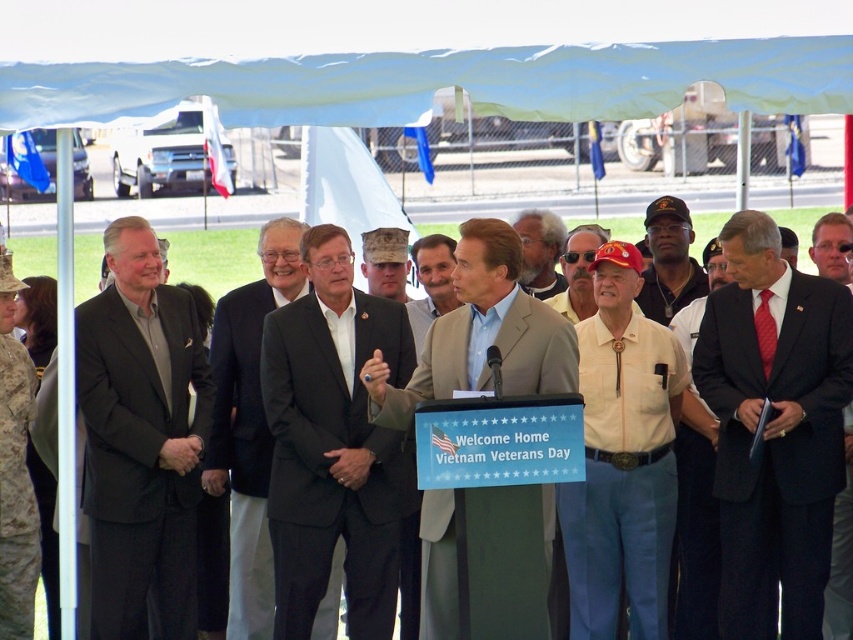
You are a photographer at the event and need to capture a clear photo of both the black suit at center and the matte black cap at center. Which object should you focus on first to ensure it appears in focus, considering their sizes in the frame?

The black suit at center is taller than the matte black cap at center, so focusing on the larger object first will ensure it appears in focus, and the smaller object will likely remain sharp in the photo.

From the picture: You are a photographer at the Vietnam Veterans Day event. You need to capture a photo that includes both the green fabric canopy at upper center and the camouflage fabric hat at center. Based on their positions, which object should be placed on the left side of the photo to ensure both are in frame?

The camouflage fabric hat at center should be placed on the left side of the photo because the green fabric canopy at upper center is to the right of it, ensuring both are included in the frame.